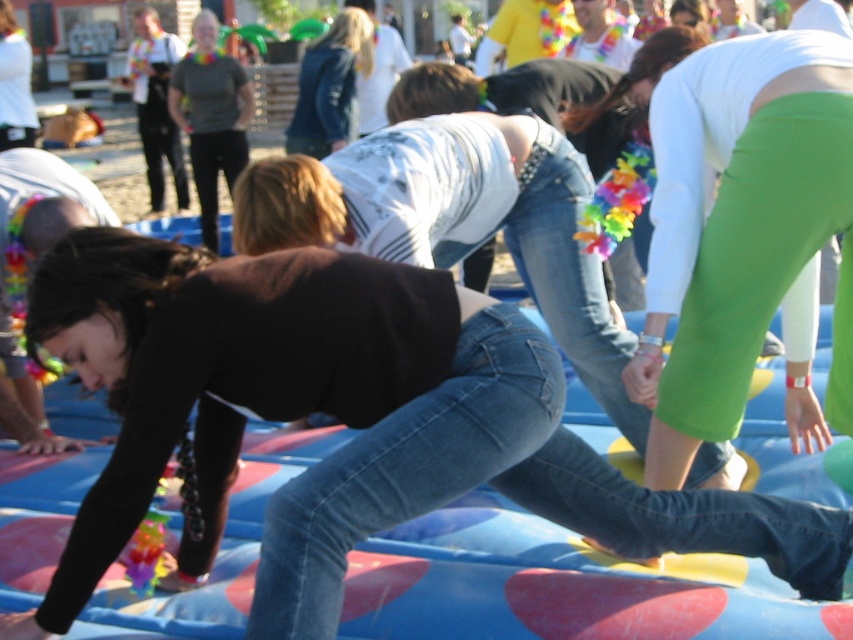
You are a photographer trying to capture a candid shot of the woman in the scene. You notice both the jeans at center and the denim jacket at center. Which clothing item is positioned lower on her body?

The jeans at center is located below denim jacket at center, so the jeans at center is positioned lower on her body.

You are organizing a costume party and need to decide which item of clothing from the image can fit into a small storage box. Based on their sizes, which one between the jeans at center and the denim jacket at center would you choose?

The jeans at center has a smaller size compared to the denim jacket at center, so the jeans at center would fit into the small storage box better.

You are a photographer at the event and need to capture a photo of the participant wearing both green spandex pants at center and jeans at center. Can you clearly see both items in the photo?

The green spandex pants at center is positioned over jeans at center, so the jeans at center may be partially or fully covered, making it difficult to clearly see both items in the photo.